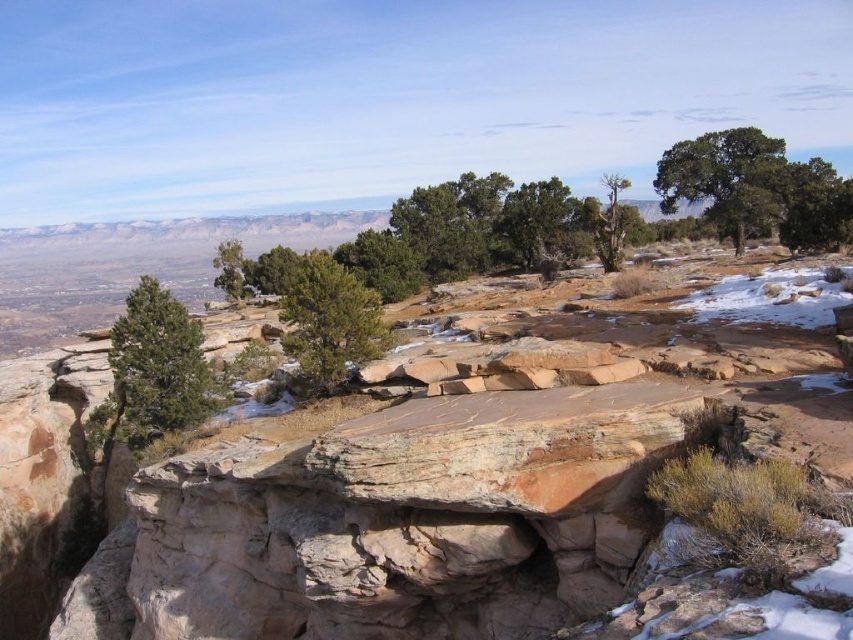
Who is higher up, green matte tree at left or green matte tree at center?

green matte tree at center is above.

Can you confirm if green matte tree at left is positioned to the right of green matte tree at center?

In fact, green matte tree at left is to the left of green matte tree at center.

Where is `green matte tree at left`? The width and height of the screenshot is (853, 640). green matte tree at left is located at coordinates (154, 372).

The height and width of the screenshot is (640, 853). Find the location of `green matte tree at left`. green matte tree at left is located at coordinates (154, 372).

Can you confirm if green matte tree at center is positioned to the left of green leafy tree at center-left?

Incorrect, green matte tree at center is not on the left side of green leafy tree at center-left.

Is green matte tree at center above green leafy tree at center-left?

No.

What do you see at coordinates (329, 321) in the screenshot? I see `green matte tree at center` at bounding box center [329, 321].

Where is `green matte tree at center`? green matte tree at center is located at coordinates (329, 321).

Who is positioned more to the right, brown rock formation at center or green leafy tree at center-left?

brown rock formation at center

Who is higher up, brown rock formation at center or green leafy tree at center-left?

green leafy tree at center-left is higher up.

In order to click on brown rock formation at center in this screenshot , I will do `click(410, 484)`.